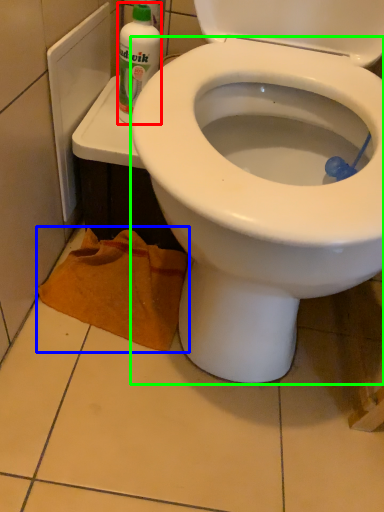
Question: Which object is positioned closest to cleaning product (highlighted by a red box)? Select from material (highlighted by a blue box) and bidet (highlighted by a green box).

Choices:
 (A) material
 (B) bidet

Answer: (A)